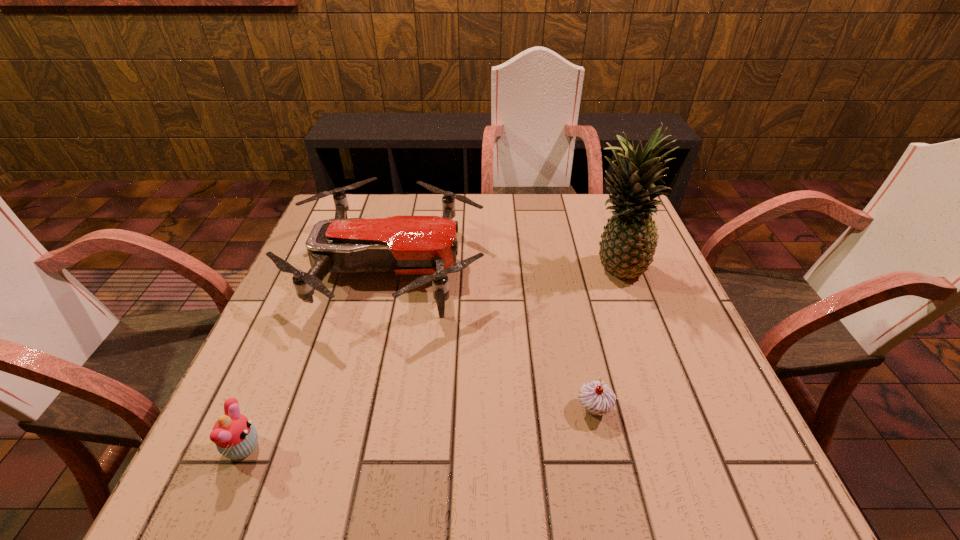
You are a GUI agent. You are given a task and a screenshot of the screen. Output one action in this format:
    pyautogui.click(x=<x>, y=<y>)
    Task: Click on the free point between the left cupcake and the second tallest object
    
    Given the screenshot: What is the action you would take?
    pyautogui.click(x=316, y=357)

You are a GUI agent. You are given a task and a screenshot of the screen. Output one action in this format:
    pyautogui.click(x=<x>, y=<y>)
    Task: Click on the free area in between the rightmost object and the left cupcake
    The width and height of the screenshot is (960, 540).
    Given the screenshot: What is the action you would take?
    pyautogui.click(x=429, y=357)

Find the location of `free space between the pineapple and the right cupcake`. free space between the pineapple and the right cupcake is located at coordinates tap(605, 338).

What are the coordinates of `free space between the second object from right to left and the pineapple` in the screenshot? It's located at (605, 338).

This screenshot has width=960, height=540. What are the coordinates of `vacant area that lies between the left cupcake and the second tallest object` in the screenshot? It's located at (316, 357).

Where is `free area in between the left cupcake and the rightmost object`? The image size is (960, 540). free area in between the left cupcake and the rightmost object is located at coordinates 429,357.

Identify the location of vacant area between the third shortest object and the pineapple. This screenshot has width=960, height=540. (x=502, y=267).

Locate an element on the screen. unoccupied area between the tallest object and the right cupcake is located at coordinates (605, 338).

This screenshot has height=540, width=960. I want to click on free space between the pineapple and the second tallest object, so click(x=502, y=267).

Where is `unoccupied area between the tallest object and the second object from right to left`? The height and width of the screenshot is (540, 960). unoccupied area between the tallest object and the second object from right to left is located at coordinates (605, 338).